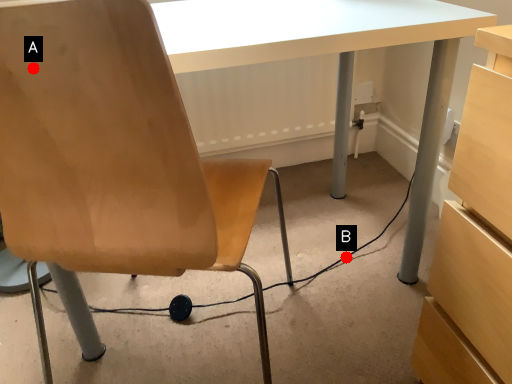
Question: Two points are circled on the image, labeled by A and B beside each circle. Which of the following is the closest to the observer?

Choices:
 (A) A is closer
 (B) B is closer

Answer: (A)